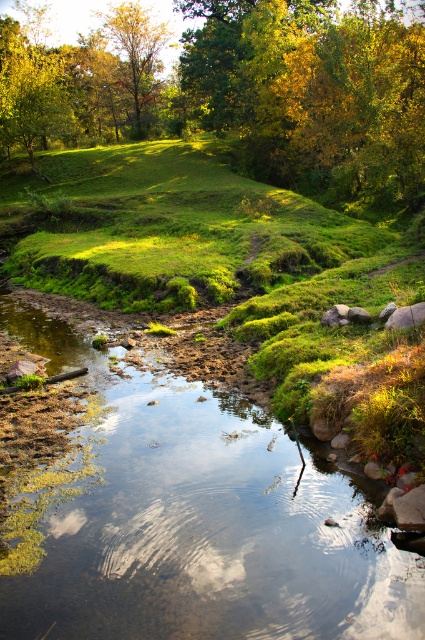
You are standing at the point with coordinates point (201, 524). Based on the scene description, what is the immediate environment around you?

The immediate environment around point (201, 524) is the clear water stream at center, which has calm surface reflecting the sky with soft white clouds and shallow areas with exposed mud and rocks.

You are a hiker who wants to cross the clear water stream at center. You notice a green leafy tree at upper center nearby. Which direction should you walk to reach the stream from the tree?

The clear water stream at center is positioned under the green leafy tree at upper center, so you should walk downward from the tree to reach the stream.

You are a hiker who wants to cross the stream without getting your boots wet. You see the clear water stream at center and the golden yellow leaves at upper center. Which object is closer to you, and can you step on it to cross?

The clear water stream at center is closer to you than the golden yellow leaves at upper center. However, stepping on the stream might get your boots wet, while the leaves are further away and not a solid surface to step on.